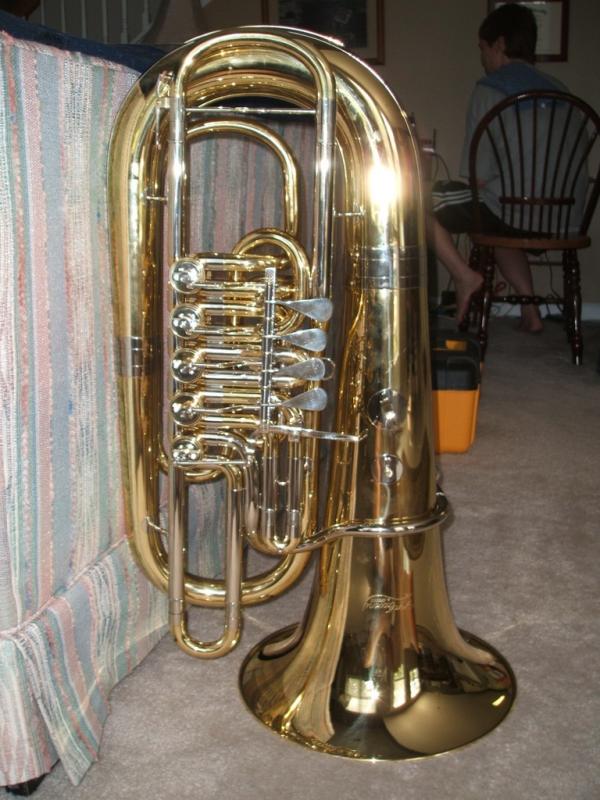
This screenshot has height=800, width=600. In order to click on sofa back in this screenshot , I will do `click(35, 122)`.